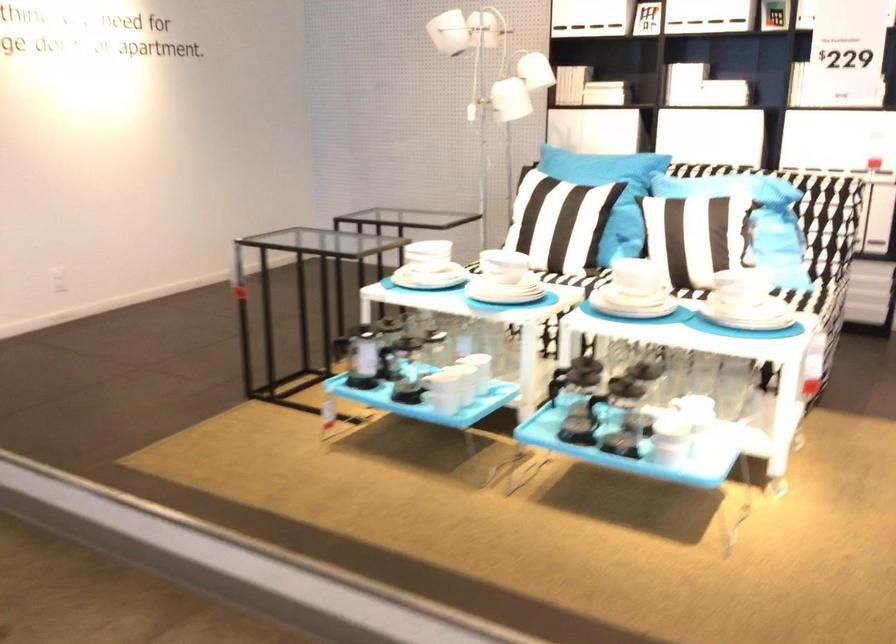
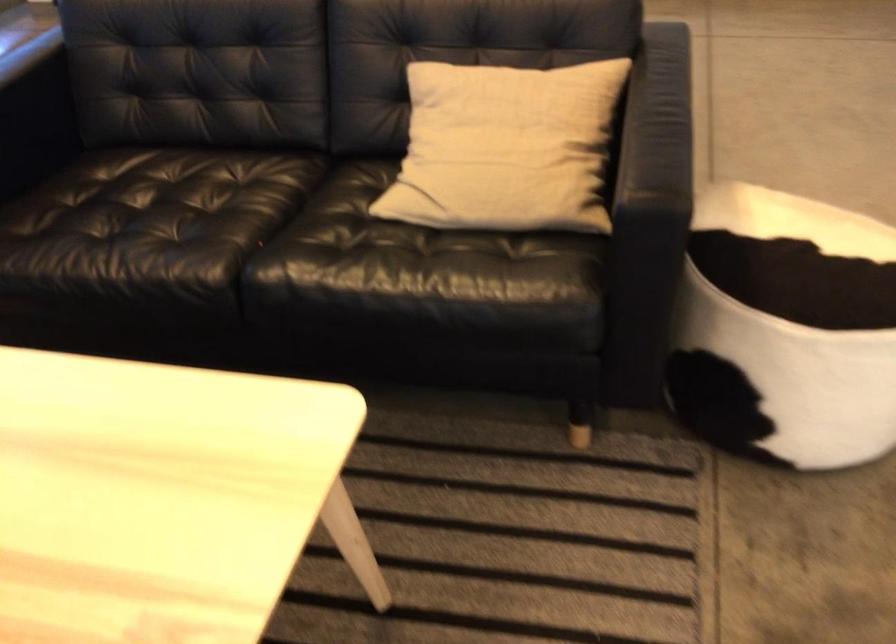
The first image is from the beginning of the video and the second image is from the end. How did the camera likely rotate when shooting the video?

The camera's rotation is toward left-down.